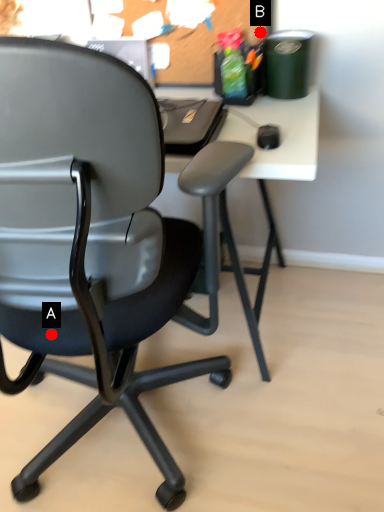
Question: Two points are circled on the image, labeled by A and B beside each circle. Which point is further to the camera?

Choices:
 (A) A is further
 (B) B is further

Answer: (B)